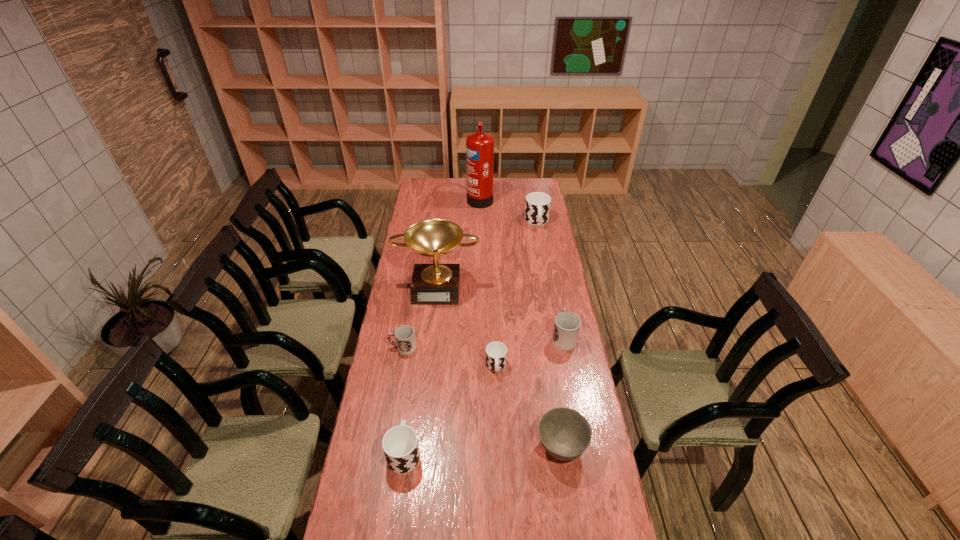
You are a GUI agent. You are given a task and a screenshot of the screen. Output one action in this format:
    pyautogui.click(x=<x>, y=<y>)
    Task: Click on the vacant space located 0.340m on the handle side of the right red cup
    
    Given the screenshot: What is the action you would take?
    pyautogui.click(x=551, y=272)

Identify the location of vacant area situated 0.120m on the side of the second smallest black cup with the handle. (411, 401).

This screenshot has height=540, width=960. What are the coordinates of `vacant space located 0.300m on the side of the second smallest black cup with the handle` in the screenshot? It's located at (417, 361).

This screenshot has width=960, height=540. In order to click on free space located 0.120m on the side of the second smallest black cup with the handle in this screenshot , I will do click(411, 401).

Find the location of `blank space located on the front of the bowl`. blank space located on the front of the bowl is located at coordinates (571, 512).

I want to click on free space located on the side of the sixth farthest object with the handle, so click(499, 451).

Where is `object that is positioned at the far edge`? object that is positioned at the far edge is located at coordinates (479, 146).

Locate an element on the screen. This screenshot has width=960, height=540. award located in the left edge section of the desktop is located at coordinates (432, 284).

The width and height of the screenshot is (960, 540). What are the coordinates of `bowl situated at the right edge` in the screenshot? It's located at (565, 433).

Identify the location of free space at the far edge of the desktop. The height and width of the screenshot is (540, 960). (445, 178).